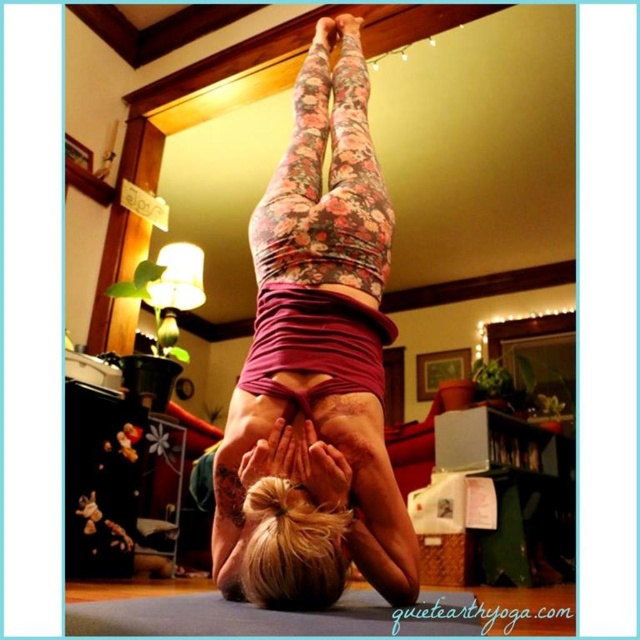
Can you confirm if floral leggings at center is wider than blue rubber yoga mat at center?

No.

Which is more to the right, floral leggings at center or blue rubber yoga mat at center?

blue rubber yoga mat at center is more to the right.

Identify the location of floral leggings at center. (316, 365).

At what (x,y) coordinates should I click in order to perform the action: click on floral leggings at center. Please return your answer as a coordinate pair (x, y). Image resolution: width=640 pixels, height=640 pixels. Looking at the image, I should click on (316, 365).